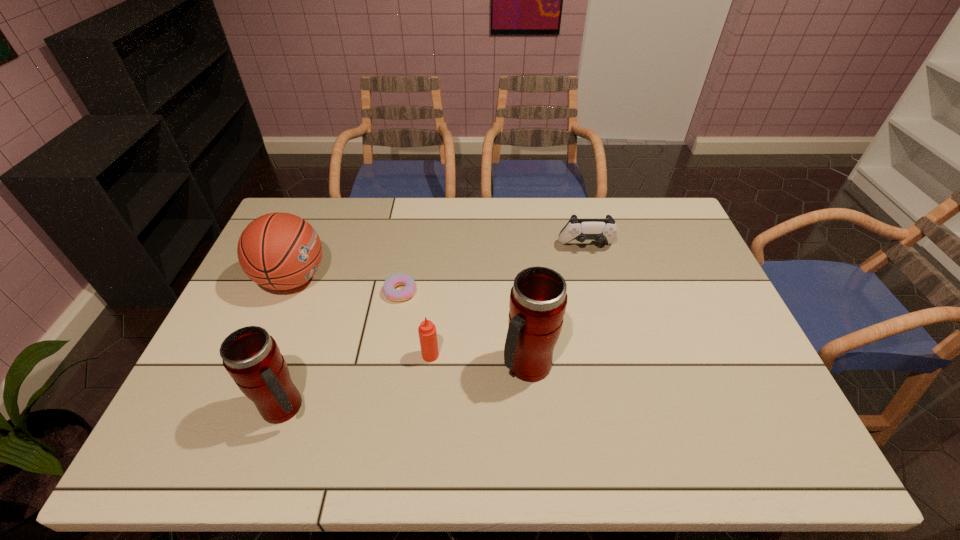
In the current image, all thermos bottles are evenly spaced. To maintain this equal spacing, where should an additional thermos bottle be placed on the right? Please point out a free spot. Please provide its 2D coordinates. Your answer should be formatted as a tuple, i.e. [(x, y)], where the tuple contains the x and y coordinates of a point satisfying the conditions above.

[(738, 330)]